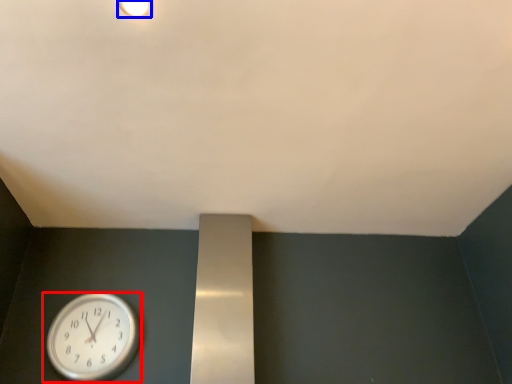
Question: Which object is further to the camera taking this photo, wall clock (highlighted by a red box) or light fixture (highlighted by a blue box)?

Choices:
 (A) wall clock
 (B) light fixture

Answer: (A)